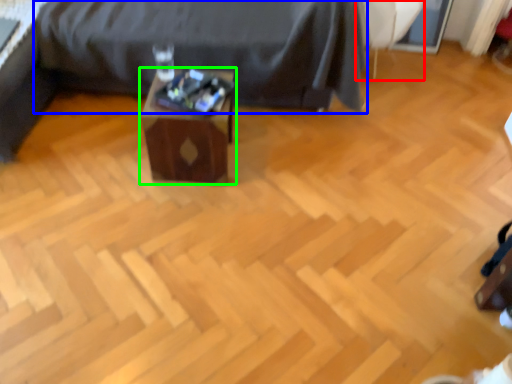
Question: Based on their relative distances, which object is nearer to swivel chair (highlighted by a red box)? Choose from furniture (highlighted by a blue box) and table (highlighted by a green box).

Choices:
 (A) furniture
 (B) table

Answer: (A)